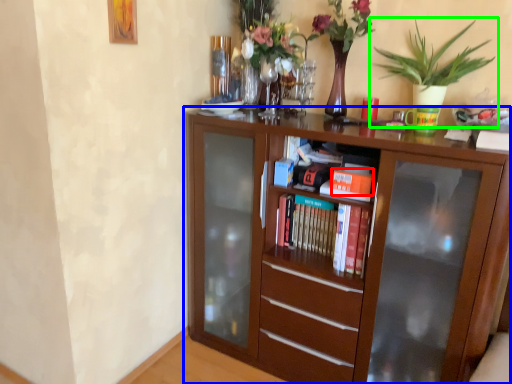
Question: Which is farther away from book (highlighted by a red box)? bookcase (highlighted by a blue box) or houseplant (highlighted by a green box)?

Choices:
 (A) bookcase
 (B) houseplant

Answer: (B)